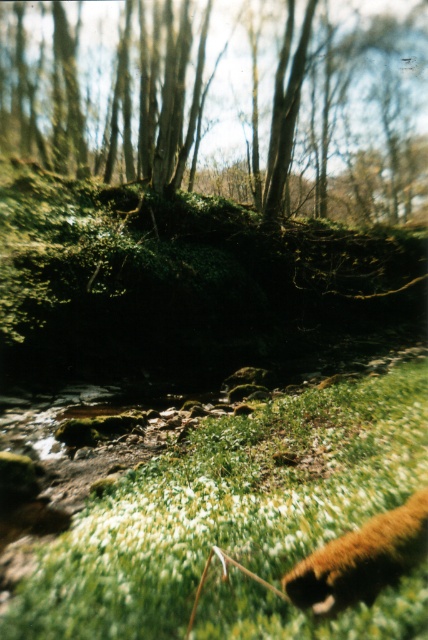
You are a hiker who wants to take a photo of the green mossy tree at upper center and the brown furry animal at lower right. Which one should you zoom in more on to capture both in the frame?

Since the green mossy tree at upper center is larger than the brown furry animal at lower right, you should zoom in more on the brown furry animal at lower right to ensure both fit in the frame.

You are a hiker who wants to take a photo of the green mossy tree at upper center and the brown furry animal at lower right. Which object is wider?

The green mossy tree at upper center might be wider than brown furry animal at lower right.